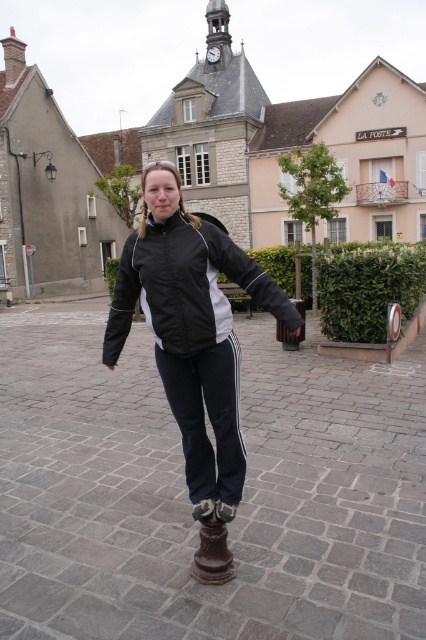
Question: Which of the following is the closest to the observer?

Choices:
 (A) (169, 237)
 (B) (172, 205)

Answer: (B)

Question: Is black matte jacket at center thinner than black/waterproof jacket at center?

Choices:
 (A) no
 (B) yes

Answer: (B)

Question: Can you confirm if black matte jacket at center is wider than black/waterproof jacket at center?

Choices:
 (A) no
 (B) yes

Answer: (A)

Question: Which object is closer to the camera taking this photo?

Choices:
 (A) black matte jacket at center
 (B) black/waterproof jacket at center

Answer: (A)

Question: Among these objects, which one is farthest from the camera?

Choices:
 (A) black matte jacket at center
 (B) black/waterproof jacket at center

Answer: (B)

Question: Is black matte jacket at center wider than black/waterproof jacket at center?

Choices:
 (A) no
 (B) yes

Answer: (A)